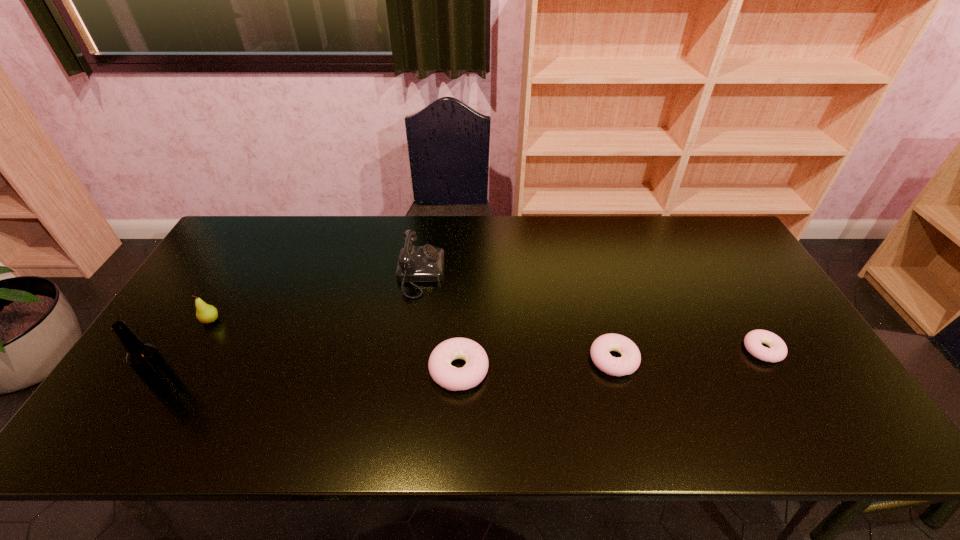
You are a GUI agent. You are given a task and a screenshot of the screen. Output one action in this format:
    pyautogui.click(x=<x>, y=<y>)
    Task: Click on the object that is at the near left corner
    The width and height of the screenshot is (960, 540).
    Given the screenshot: What is the action you would take?
    pyautogui.click(x=145, y=359)

You are a GUI agent. You are given a task and a screenshot of the screen. Output one action in this format:
    pyautogui.click(x=<x>, y=<y>)
    Task: Click on the vacant space at the far edge of the desktop
    Image resolution: width=960 pixels, height=540 pixels.
    Given the screenshot: What is the action you would take?
    pyautogui.click(x=462, y=227)

The image size is (960, 540). In order to click on free location at the near edge of the desktop in this screenshot , I will do `click(290, 393)`.

You are a GUI agent. You are given a task and a screenshot of the screen. Output one action in this format:
    pyautogui.click(x=<x>, y=<y>)
    Task: Click on the free space at the left edge of the desktop
    
    Given the screenshot: What is the action you would take?
    pyautogui.click(x=220, y=334)

In the image, there is a desktop. Where is `free space at the right edge`? The width and height of the screenshot is (960, 540). free space at the right edge is located at coordinates (726, 263).

Locate an element on the screen. This screenshot has width=960, height=540. vacant space at the far right corner of the desktop is located at coordinates (721, 255).

In the image, there is a desktop. What are the coordinates of `free region at the near right corner` in the screenshot? It's located at (771, 380).

Find the location of `empty space that is in between the telephone and the pear`. empty space that is in between the telephone and the pear is located at coordinates pyautogui.click(x=316, y=297).

The height and width of the screenshot is (540, 960). What are the coordinates of `free space between the beer bottle and the second farthest object` in the screenshot? It's located at (189, 354).

Find the location of a particular element. The width and height of the screenshot is (960, 540). free space between the second object from right to left and the tallest doughnut is located at coordinates (537, 364).